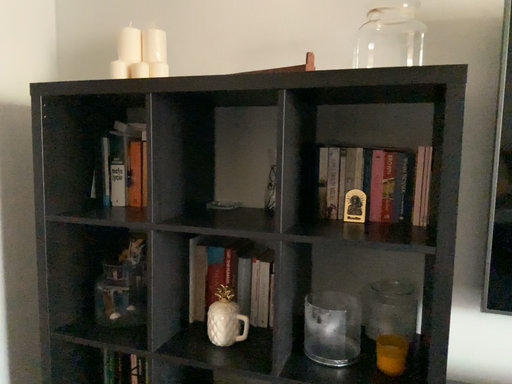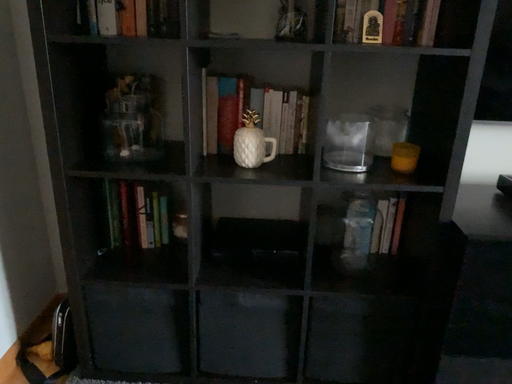
Question: How did the camera likely rotate when shooting the video?

Choices:
 (A) rotated right
 (B) rotated left

Answer: (A)